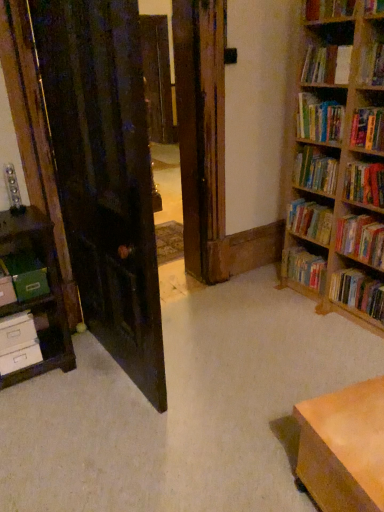
Question: Can you confirm if white matte drawer at lower left, the second drawer from the top, is positioned to the left of dark wood door at left?

Choices:
 (A) yes
 (B) no

Answer: (A)

Question: Does white matte drawer at lower left, marked as the first drawer in a bottom-to-top arrangement, appear on the right side of dark wood door at left?

Choices:
 (A) yes
 (B) no

Answer: (B)

Question: Can you confirm if white matte drawer at lower left, the second drawer from the top, is thinner than dark wood door at left?

Choices:
 (A) yes
 (B) no

Answer: (A)

Question: Can you confirm if white matte drawer at lower left, marked as the first drawer in a bottom-to-top arrangement, is bigger than dark wood door at left?

Choices:
 (A) no
 (B) yes

Answer: (A)

Question: Can you confirm if white matte drawer at lower left, marked as the first drawer in a bottom-to-top arrangement, is shorter than dark wood door at left?

Choices:
 (A) yes
 (B) no

Answer: (A)

Question: Does white matte drawer at lower left, marked as the first drawer in a bottom-to-top arrangement, have a greater height compared to dark wood door at left?

Choices:
 (A) no
 (B) yes

Answer: (A)

Question: Is hardcover book at upper right, arranged as the fifth book when viewed from the top, to the right of dark wood door at left from the viewer's perspective?

Choices:
 (A) no
 (B) yes

Answer: (B)

Question: Considering the relative sizes of hardcover book at upper right, which is the 5th book in bottom-to-top order, and dark wood door at left in the image provided, is hardcover book at upper right, which is the 5th book in bottom-to-top order, smaller than dark wood door at left?

Choices:
 (A) yes
 (B) no

Answer: (A)

Question: Is hardcover book at upper right, which is the 5th book in bottom-to-top order, shorter than dark wood door at left?

Choices:
 (A) no
 (B) yes

Answer: (B)

Question: Does hardcover book at upper right, arranged as the fifth book when viewed from the top, turn towards dark wood door at left?

Choices:
 (A) yes
 (B) no

Answer: (A)

Question: From the image's perspective, is hardcover book at upper right, which is the 5th book in bottom-to-top order, below dark wood door at left?

Choices:
 (A) no
 (B) yes

Answer: (A)

Question: Could dark wood door at left be considered to be inside hardcover book at upper right, arranged as the fifth book when viewed from the top?

Choices:
 (A) no
 (B) yes

Answer: (A)

Question: Is hardcover books at upper right, the 3th book in the top-to-bottom sequence, aimed at green matte paper at left?

Choices:
 (A) no
 (B) yes

Answer: (B)